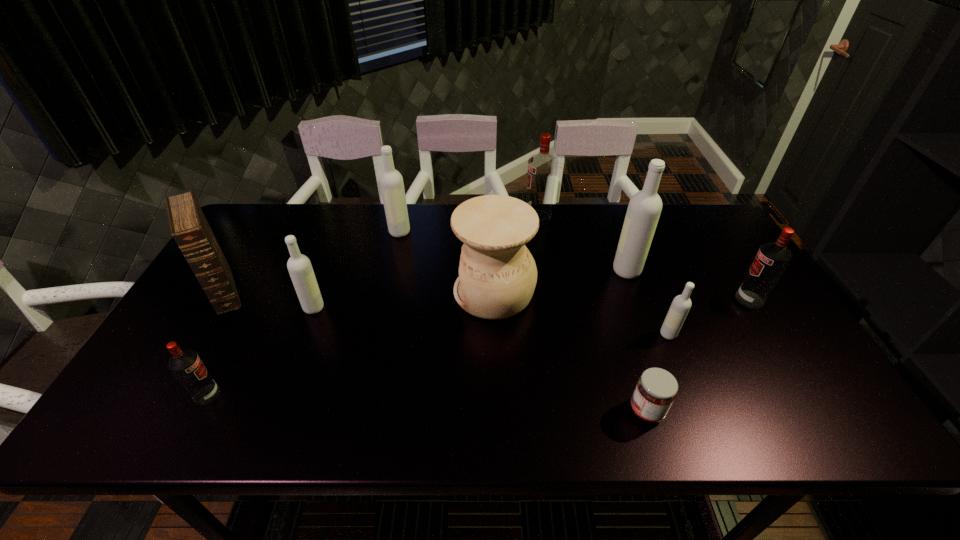
I want to click on free space between the third nearest object and the Bible, so (x=446, y=312).

Locate an element on the screen. free space between the pottery and the shortest object is located at coordinates (570, 352).

You are a GUI agent. You are given a task and a screenshot of the screen. Output one action in this format:
    pyautogui.click(x=<x>, y=<y>)
    Task: Click on the free space that is in between the second nearest vodka and the nearest red vodka
    Image resolution: width=960 pixels, height=540 pixels.
    Given the screenshot: What is the action you would take?
    pyautogui.click(x=438, y=364)

What are the coordinates of `empty space between the fourth vodka from right to left and the leftmost white vodka` in the screenshot? It's located at (425, 262).

Select which object is the seventh closest to the rightmost object. Please provide its 2D coordinates. Your answer should be formatted as a tuple, i.e. [(x, y)], where the tuple contains the x and y coordinates of a point satisfying the conditions above.

[(299, 266)]

Identify the location of object that stands as the closest to the rightmost red vodka. Image resolution: width=960 pixels, height=540 pixels. (681, 304).

You are a GUI agent. You are given a task and a screenshot of the screen. Output one action in this format:
    pyautogui.click(x=<x>, y=<y>)
    Task: Click on the vodka that stands as the closest to the farthest red vodka
    
    Given the screenshot: What is the action you would take?
    (644, 209)

Choose which vodka is the nearest neighbor to the smallest red vodka. Please provide its 2D coordinates. Your answer should be formatted as a tuple, i.e. [(x, y)], where the tuple contains the x and y coordinates of a point satisfying the conditions above.

[(299, 266)]

Select which white vodka appears as the second closest to the cream pottery. Please provide its 2D coordinates. Your answer should be formatted as a tuple, i.e. [(x, y)], where the tuple contains the x and y coordinates of a point satisfying the conditions above.

[(644, 209)]

Point out which white vodka is positioned as the second nearest to the nearest white vodka. Please provide its 2D coordinates. Your answer should be formatted as a tuple, i.e. [(x, y)], where the tuple contains the x and y coordinates of a point satisfying the conditions above.

[(391, 181)]